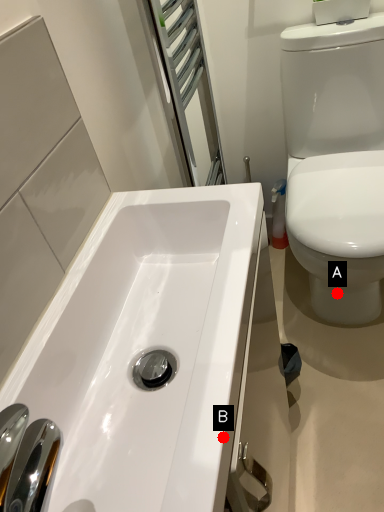
Question: Two points are circled on the image, labeled by A and B beside each circle. Which of the following is the closest to the observer?

Choices:
 (A) A is closer
 (B) B is closer

Answer: (B)